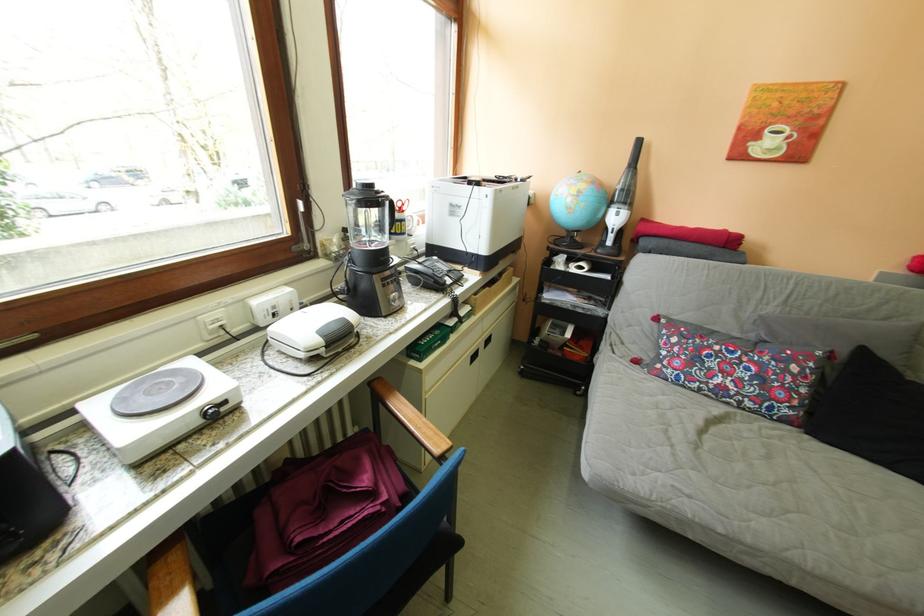
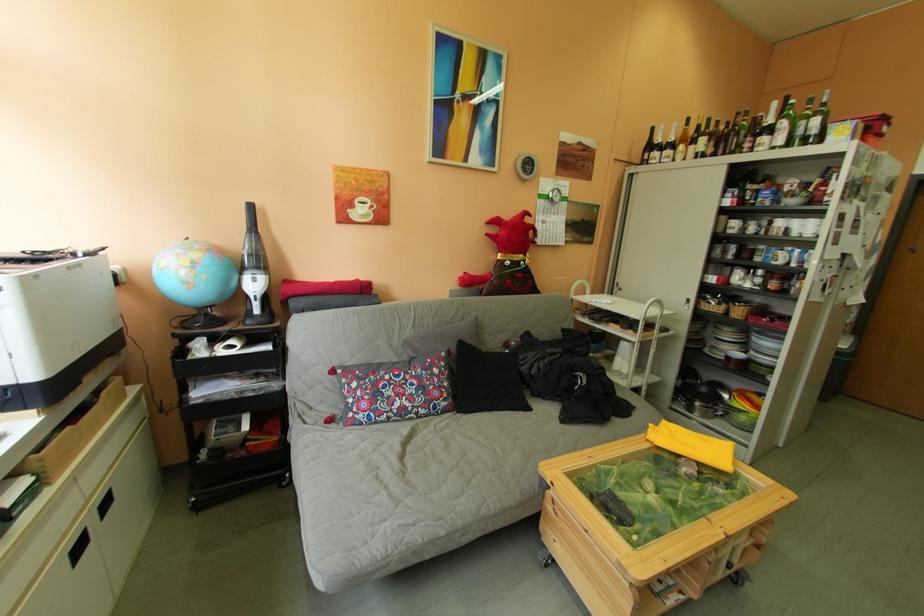
Question: The camera is either moving clockwise (left) or counter-clockwise (right) around the object. The first image is from the beginning of the video and the second image is from the end. Is the camera moving left or right when shooting the video?

Choices:
 (A) Left
 (B) Right

Answer: (A)